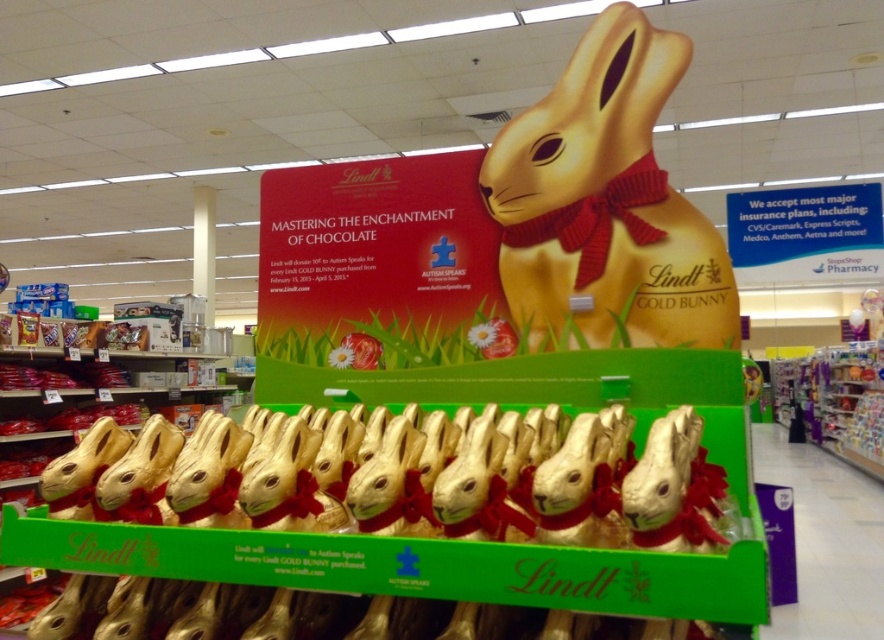
Question: Which point is farther to the camera?

Choices:
 (A) gold shiny bunny at center
 (B) gold shiny chocolate bunnies at center

Answer: (A)

Question: Can you confirm if gold shiny chocolate bunnies at center is positioned to the right of gold shiny bunny at center?

Choices:
 (A) yes
 (B) no

Answer: (B)

Question: Which object is farther from the camera taking this photo?

Choices:
 (A) gold shiny chocolate bunnies at center
 (B) gold shiny bunny at center

Answer: (B)

Question: Is gold shiny chocolate bunnies at center above gold shiny bunny at center?

Choices:
 (A) no
 (B) yes

Answer: (A)

Question: Can you confirm if gold shiny chocolate bunnies at center is positioned below gold shiny bunny at center?

Choices:
 (A) no
 (B) yes

Answer: (B)

Question: Among these points, which one is farthest from the camera?

Choices:
 (A) (721, 308)
 (B) (176, 580)

Answer: (A)